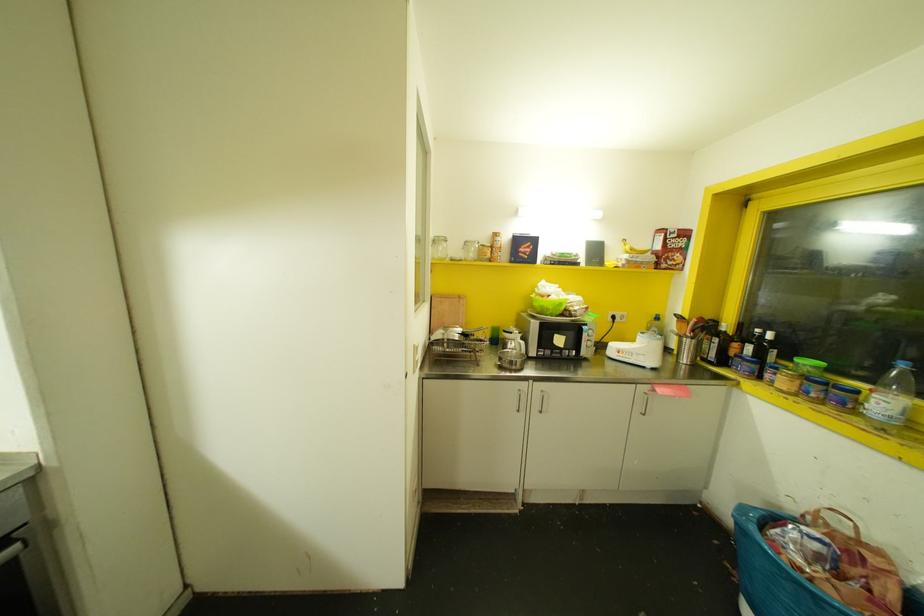
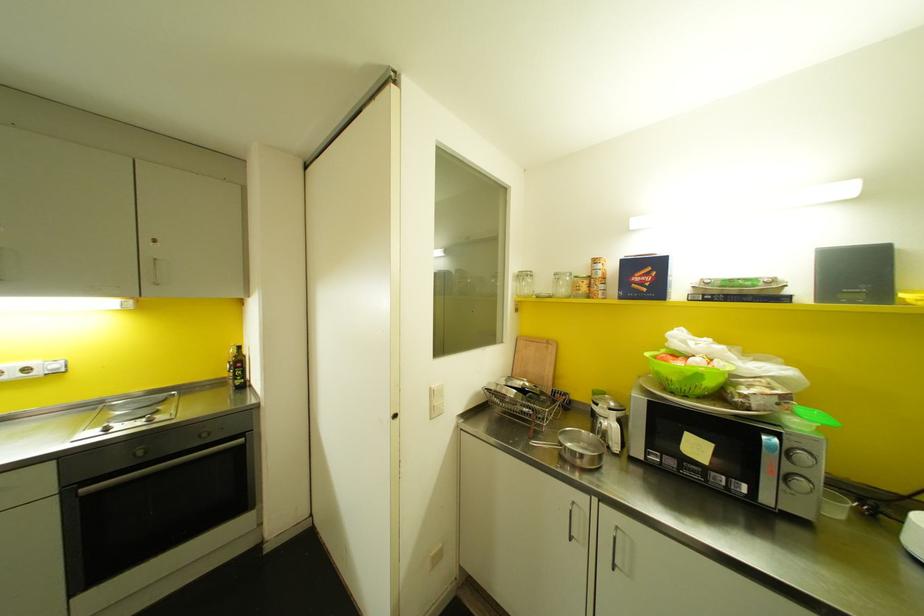
The point at (470, 254) is marked in the first image. Where is the corresponding point in the second image?

(562, 290)